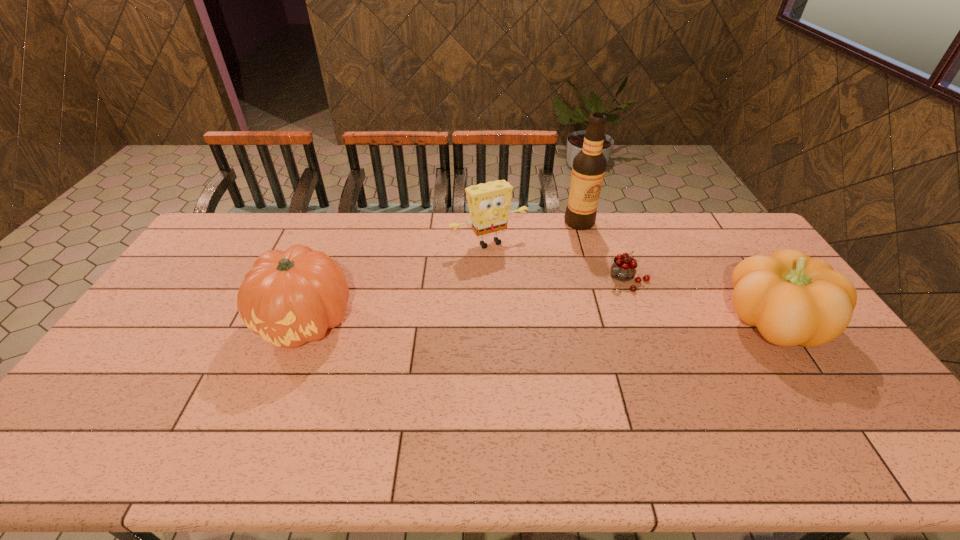
Identify the location of vacant space located on the handle side of the pot filled with cherries. (574, 326).

You are a GUI agent. You are given a task and a screenshot of the screen. Output one action in this format:
    pyautogui.click(x=<x>, y=<y>)
    Task: Click on the vacant region located 0.150m on the handle side of the pot filled with cherries
    
    Given the screenshot: What is the action you would take?
    pyautogui.click(x=588, y=313)

At what (x,y) coordinates should I click in order to perform the action: click on vacant area situated 0.130m on the handle side of the pot filled with cherries. Please return your answer as a coordinate pair (x, y). This screenshot has width=960, height=540. Looking at the image, I should click on (591, 310).

At what (x,y) coordinates should I click in order to perform the action: click on vacant space located on the label of the alcohol. Please return your answer as a coordinate pair (x, y). The image size is (960, 540). Looking at the image, I should click on (586, 249).

Locate an element on the screen. The height and width of the screenshot is (540, 960). free space located on the label of the alcohol is located at coordinates (590, 272).

Where is `vacant space positioned on the label of the alcohol`? The width and height of the screenshot is (960, 540). vacant space positioned on the label of the alcohol is located at coordinates (592, 282).

The image size is (960, 540). I want to click on sponge that is at the far edge, so click(x=489, y=204).

Where is `alcohol located in the far edge section of the desktop`? The height and width of the screenshot is (540, 960). alcohol located in the far edge section of the desktop is located at coordinates (589, 165).

Where is `object that is at the right edge`? The height and width of the screenshot is (540, 960). object that is at the right edge is located at coordinates (793, 299).

Where is `free region at the far edge of the desktop`? free region at the far edge of the desktop is located at coordinates (557, 213).